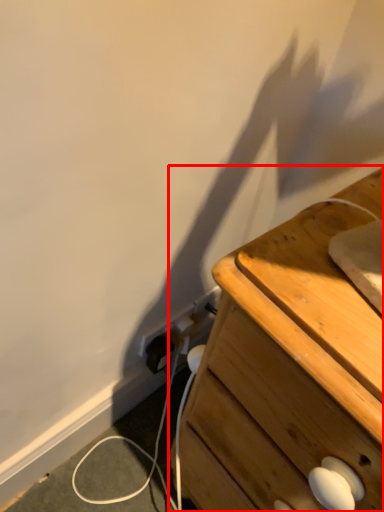
Question: From the image's perspective, where is chest of drawers (annotated by the red box) located in relation to electric outlet in the image?

Choices:
 (A) above
 (B) below

Answer: (B)